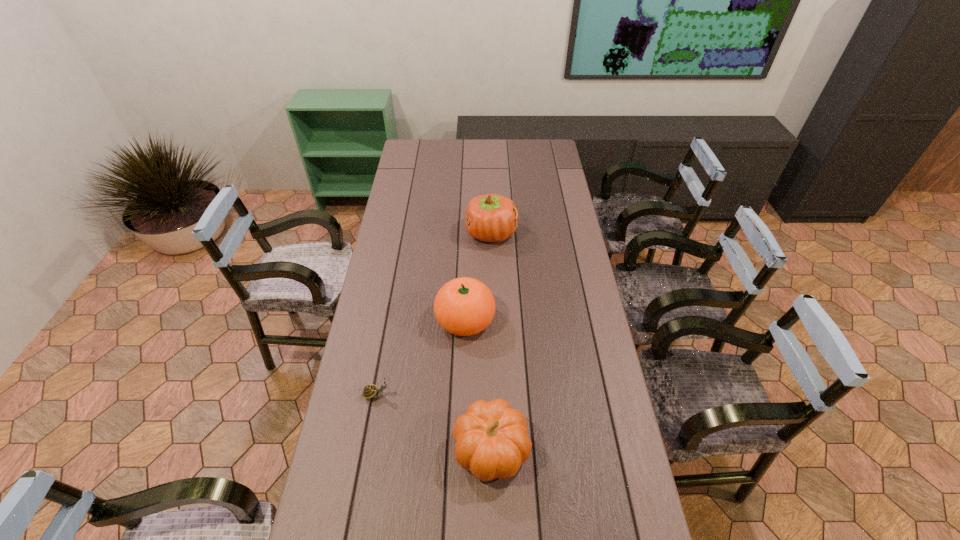
Where is `vacant region that satisfies the following two spatial constraints: 1. on the back side of the nearest pumpkin; 2. on the face of the shortest object`? The width and height of the screenshot is (960, 540). vacant region that satisfies the following two spatial constraints: 1. on the back side of the nearest pumpkin; 2. on the face of the shortest object is located at coordinates (491, 395).